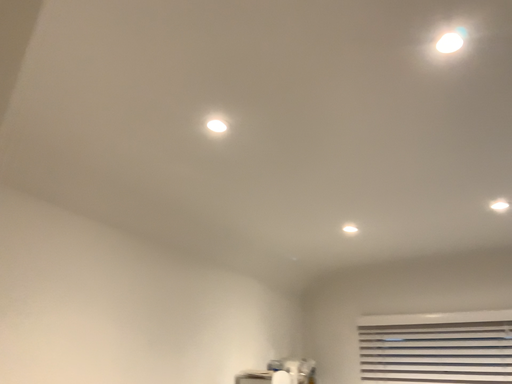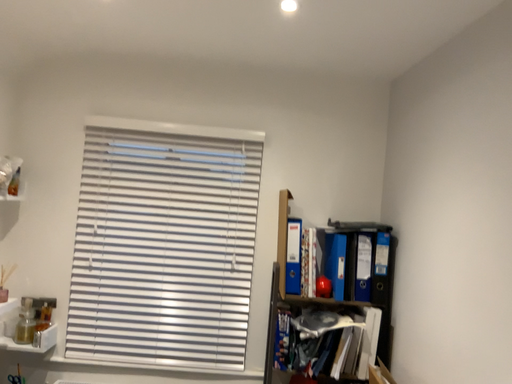
Question: How did the camera likely rotate when shooting the video?

Choices:
 (A) rotated right
 (B) rotated left

Answer: (A)